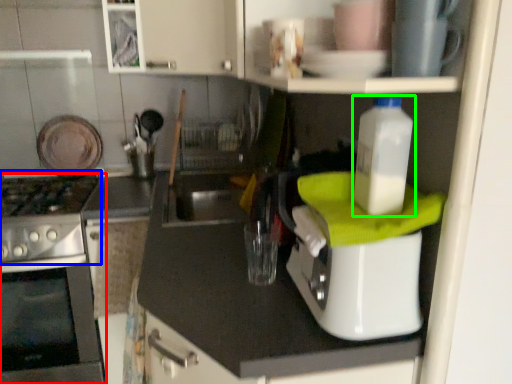
Question: Based on their relative distances, which object is farther from home appliance (highlighted by a red box)? Choose from gas stove (highlighted by a blue box) and bottle (highlighted by a green box).

Choices:
 (A) gas stove
 (B) bottle

Answer: (B)